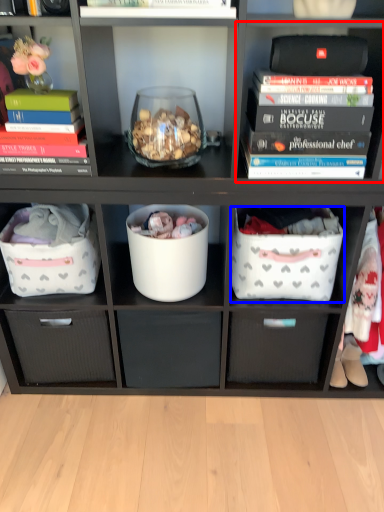
Question: Which object appears farthest to the camera in this image, shelf (highlighted by a red box) or laundry basket (highlighted by a blue box)?

Choices:
 (A) shelf
 (B) laundry basket

Answer: (B)